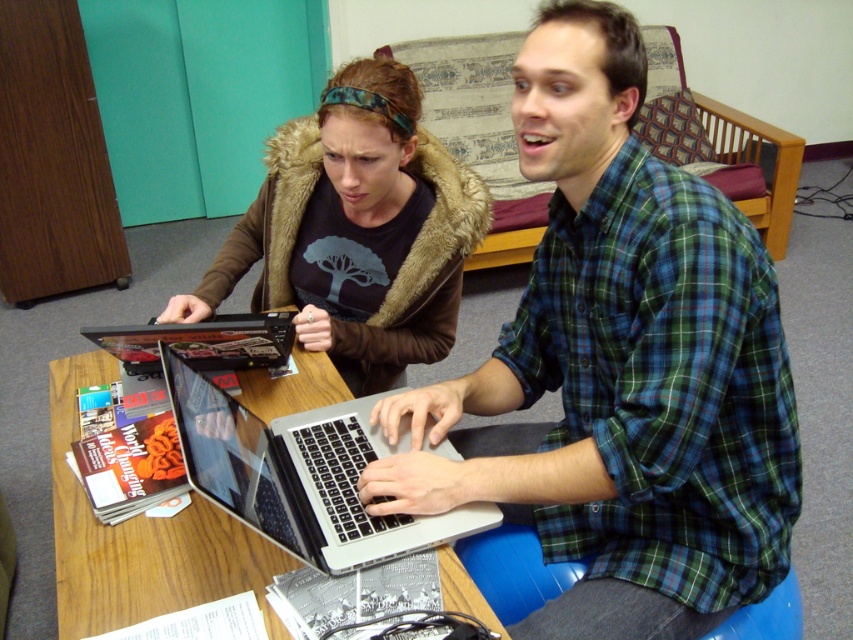
You are a photographer who wants to take a picture of the wooden table at center without including the brown fur coat at upper left in the frame. Is it possible to adjust your position or angle to achieve this?

The brown fur coat at upper left is located above the wooden table at center, so by positioning yourself lower or angling the camera downward, you can avoid capturing the coat in the frame while focusing on the wooden table at center.

You are a photographer standing in front of the wooden table at center and the silver metallic laptop at center. You want to take a photo that captures both objects clearly. Which object should you focus on first to ensure both are in sharp focus?

The wooden table at center is closer to the viewer than the silver metallic laptop at center. To ensure both are in sharp focus, you should focus on the wooden table at center first, as it is closer, and the depth of field may extend to include the laptop.

You are a delivery person who needs to place a small package on the table. The package requires at least 12 inches of space to avoid falling off. Based on the scene, can you safely place the package between the brown fur coat at upper left and the wooden table at center?

The brown fur coat at upper left is only 11.46 inches away from the wooden table at center, which is less than the required 12 inches of space. Therefore, placing the package there may cause it to fall off. Find a different spot on the table with more space.